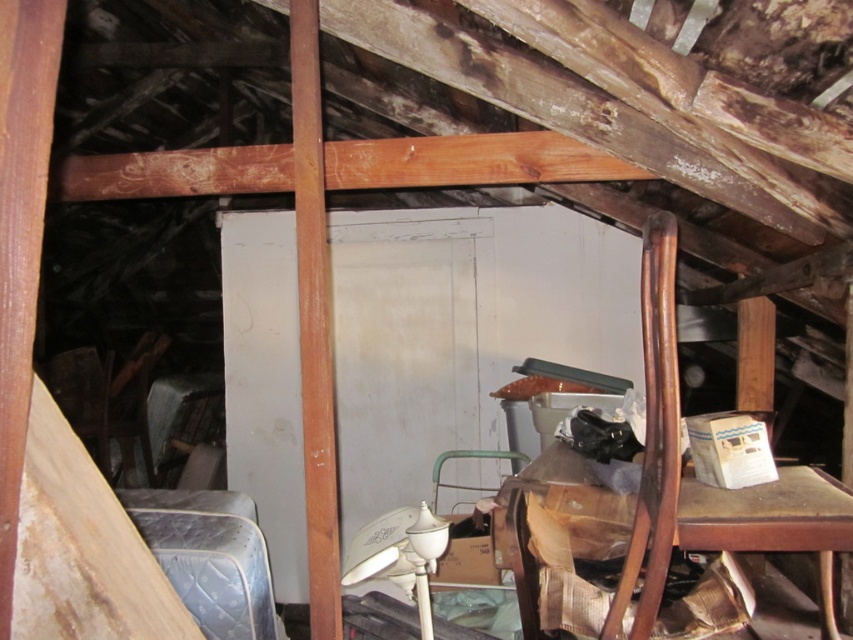
Question: Does wooden chair at center have a greater width compared to smooth wooden beam at center?

Choices:
 (A) yes
 (B) no

Answer: (A)

Question: Considering the relative positions of wooden chair at center and smooth wooden beam at center in the image provided, where is wooden chair at center located with respect to smooth wooden beam at center?

Choices:
 (A) below
 (B) above

Answer: (A)

Question: Where is wooden chair at center located in relation to blue quilted mattress at lower left in the image?

Choices:
 (A) left
 (B) right

Answer: (B)

Question: Considering the real-world distances, which object is farthest from the smooth wooden beam at center?

Choices:
 (A) blue quilted mattress at lower left
 (B) wooden chair at center

Answer: (B)

Question: Among these objects, which one is nearest to the camera?

Choices:
 (A) wooden chair at center
 (B) blue quilted mattress at lower left
 (C) smooth wooden beam at center

Answer: (A)

Question: Estimate the real-world distances between objects in this image. Which object is closer to the smooth wooden beam at center?

Choices:
 (A) blue quilted mattress at lower left
 (B) wooden chair at center

Answer: (A)